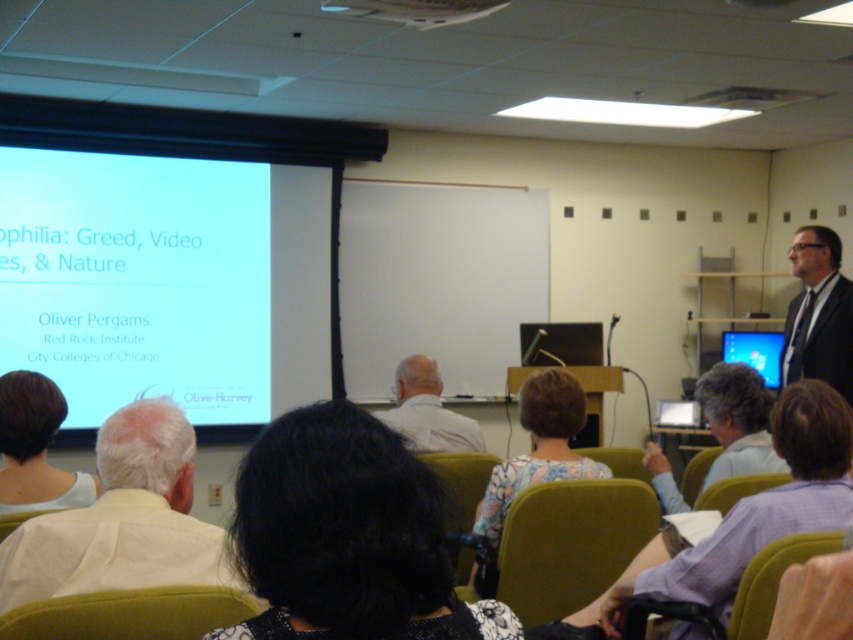
Question: Does black hair at center appear on the right side of light blue shirt at center?

Choices:
 (A) yes
 (B) no

Answer: (B)

Question: Which object is positioned farthest from the white fabric shirt at lower left?

Choices:
 (A) blue glossy monitor at right
 (B) dark blue suit at right
 (C) dark brown hair at lower left

Answer: (A)

Question: Considering the relative positions of dark blue suit at right and blue glossy monitor at right in the image provided, where is dark blue suit at right located with respect to blue glossy monitor at right?

Choices:
 (A) right
 (B) left

Answer: (B)

Question: Among these objects, which one is farthest from the camera?

Choices:
 (A) dark blue suit at right
 (B) light blue shirt at center
 (C) blue glossy monitor at right

Answer: (C)

Question: Is metallic projector at upper center smaller than blue glossy monitor at right?

Choices:
 (A) no
 (B) yes

Answer: (B)

Question: Which point is farther to the camera?

Choices:
 (A) metallic projector at upper center
 (B) white matte shirt at center
 (C) white matte projection screen at left
 (D) light blue shirt at center

Answer: (C)